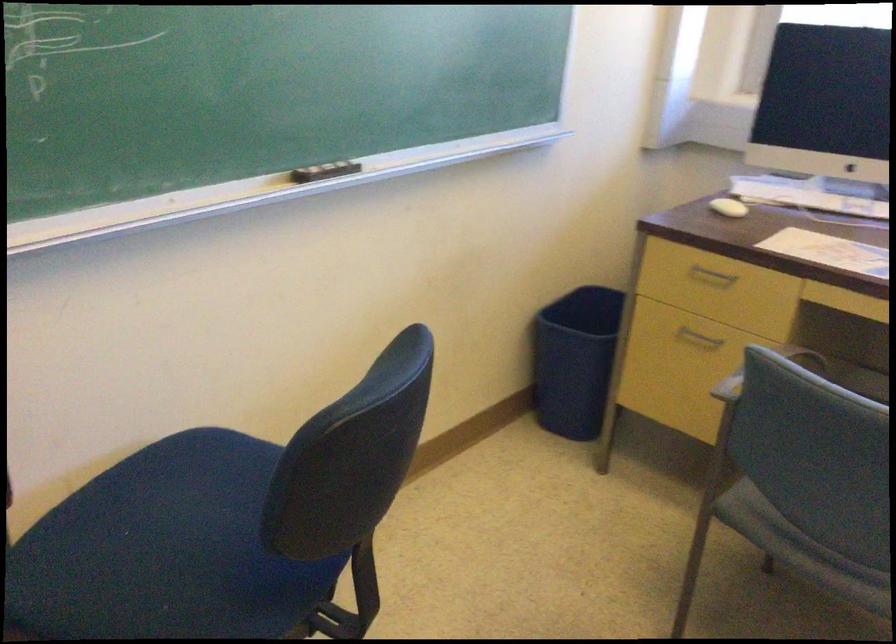
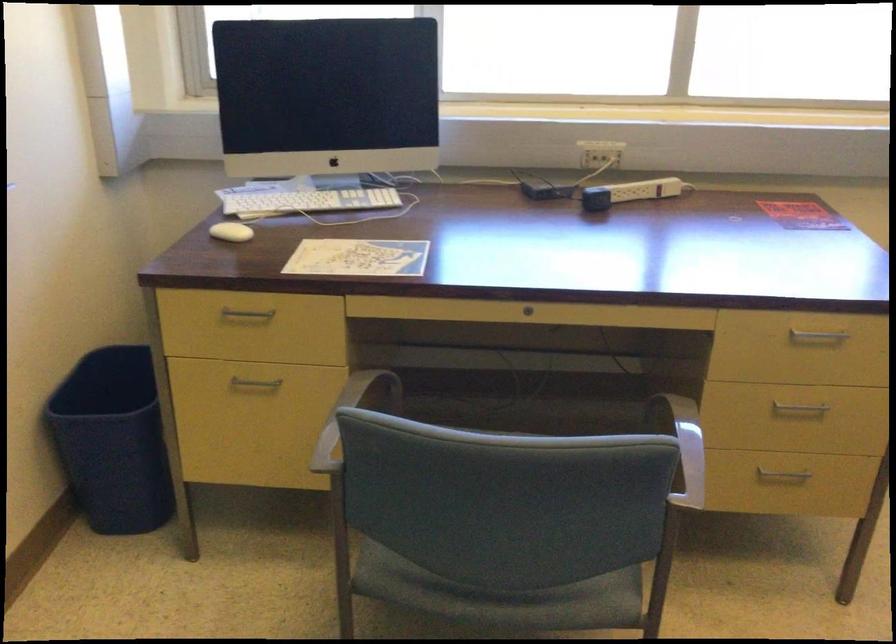
Where in the second image is the point corresponding to (x=760, y=351) from the first image?

(350, 415)